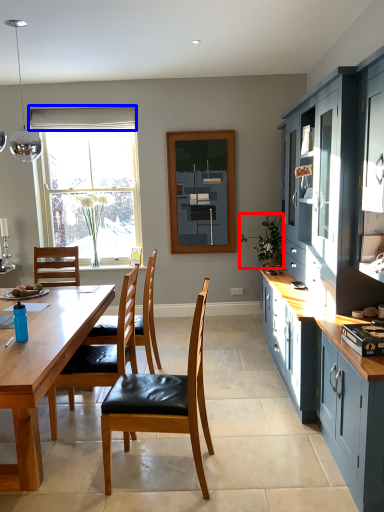
Question: Which of the following is the farthest to the observer, houseplant (highlighted by a red box) or curtain (highlighted by a blue box)?

Choices:
 (A) houseplant
 (B) curtain

Answer: (B)